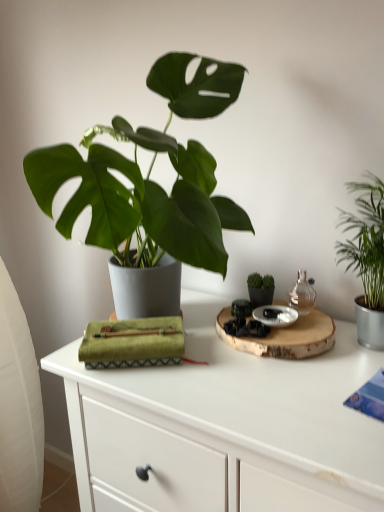
The height and width of the screenshot is (512, 384). What do you see at coordinates (302, 294) in the screenshot?
I see `transparent glass bottle at upper right` at bounding box center [302, 294].

Looking at this image, measure the distance between point (x=269, y=303) and camera.

Point (x=269, y=303) and camera are 3.36 feet apart.

You are a GUI agent. You are given a task and a screenshot of the screen. Output one action in this format:
    pyautogui.click(x=<x>, y=<y>)
    Task: Click on the transparent glass bottle at upper right
    
    Given the screenshot: What is the action you would take?
    pyautogui.click(x=302, y=294)

Based on the photo, in the image, is transparent glass bottle at upper right positioned in front of or behind matte black pot at center?

transparent glass bottle at upper right is positioned closer to the viewer than matte black pot at center.

The height and width of the screenshot is (512, 384). What are the coordinates of `glass vase above the matte black pot at center (from a real-world perspective)` in the screenshot? It's located at pos(302,294).

Between transparent glass bottle at upper right and matte black pot at center, which one has less height?

matte black pot at center.

Is green leafy plant at right surrounded by matte black pot at center?

No, green leafy plant at right is not inside matte black pot at center.

Can you confirm if matte black pot at center is bigger than green leafy plant at right?

No, matte black pot at center is not bigger than green leafy plant at right.

Is matte black pot at center placed right next to green leafy plant at right?

No, matte black pot at center is not next to green leafy plant at right.

Which of these two, matte black pot at center or green leafy plant at right, is wider?

Wider between the two is green leafy plant at right.

Is white matte table at center looking in the opposite direction of green leafy plant at right?

No, white matte table at center's orientation is not away from green leafy plant at right.

From a real-world perspective, is white matte table at center below green leafy plant at right?

Yes.

Does white matte table at center appear on the right side of green leafy plant at right?

In fact, white matte table at center is to the left of green leafy plant at right.

Looking at this image, is matte black pot at center taller or shorter than white matte table at center?

matte black pot at center is shorter than white matte table at center.

Between matte black pot at center and white matte table at center, which one appears on the left side from the viewer's perspective?

Positioned to the left is white matte table at center.

At what (x,y) coordinates should I click in order to perform the action: click on table in front of the matte black pot at center. Please return your answer as a coordinate pair (x, y). Looking at the image, I should click on (225, 426).

Between matte black pot at center and white matte table at center, which one has larger size?

Bigger between the two is white matte table at center.

Which is behind, point (339, 418) or point (301, 278)?

The point (301, 278) is farther from the camera.

Is white matte table at center at the right side of transparent glass bottle at upper right?

No.

From the image's perspective, which one is positioned lower, white matte table at center or transparent glass bottle at upper right?

white matte table at center.

Is white matte table at center wider than transparent glass bottle at upper right?

Correct, the width of white matte table at center exceeds that of transparent glass bottle at upper right.

Does transparent glass bottle at upper right have a lesser height compared to green leafy plant at right?

Yes.

Would you consider transparent glass bottle at upper right to be distant from green leafy plant at right?

No, transparent glass bottle at upper right is in close proximity to green leafy plant at right.

How different are the orientations of transparent glass bottle at upper right and green leafy plant at right in degrees?

The angle between the facing direction of transparent glass bottle at upper right and the facing direction of green leafy plant at right is 26.5 degrees.

Who is smaller, transparent glass bottle at upper right or green leafy plant at right?

Smaller between the two is transparent glass bottle at upper right.

Considering the relative sizes of green leafy plant at right and matte black pot at center in the image provided, is green leafy plant at right bigger than matte black pot at center?

Yes.

Which is correct: green leafy plant at right is inside matte black pot at center, or outside of it?

green leafy plant at right is not enclosed by matte black pot at center.

From the picture: Who is taller, green leafy plant at right or matte black pot at center?

green leafy plant at right.

Between green leafy plant at right and matte black pot at center, which one has smaller width?

With smaller width is matte black pot at center.

Locate an element on the screen. The width and height of the screenshot is (384, 512). glass vase that appears in front of the matte black pot at center is located at coordinates (302, 294).

At what (x,y) coordinates should I click in order to perform the action: click on flowerpot that appears behind the green leafy plant at right. Please return your answer as a coordinate pair (x, y). Image resolution: width=384 pixels, height=512 pixels. Looking at the image, I should click on (261, 296).

Which object lies further to the anchor point white matte table at center, matte black pot at center or transparent glass bottle at upper right?

Among the two, transparent glass bottle at upper right is located further to white matte table at center.

Which object lies further to the anchor point green leafy plant at right, matte black pot at center or transparent glass bottle at upper right?

matte black pot at center.

Which object lies nearer to the anchor point matte black pot at center, white matte table at center or green leafy plant at right?

Among the two, green leafy plant at right is located nearer to matte black pot at center.

Looking at the image, which one is located closer to transparent glass bottle at upper right, white matte table at center or green leafy plant at right?

green leafy plant at right is positioned closer to the anchor transparent glass bottle at upper right.

Based on the photo, which object lies further to the anchor point matte black pot at center, white matte table at center or transparent glass bottle at upper right?

white matte table at center is further to matte black pot at center.

Which object lies further to the anchor point green leafy plant at right, white matte table at center or transparent glass bottle at upper right?

white matte table at center.

When comparing their distances from green leafy plant at right, does matte black pot at center or white matte table at center seem closer?

matte black pot at center lies closer to green leafy plant at right than the other object.

Looking at the image, which one is located closer to matte black pot at center, transparent glass bottle at upper right or green leafy plant at right?

transparent glass bottle at upper right.

I want to click on flowerpot between transparent glass bottle at upper right and white matte table at center in the up-down direction, so click(x=261, y=296).

The width and height of the screenshot is (384, 512). What are the coordinates of `glass vase between green leafy plant at right and white matte table at center in the up-down direction` in the screenshot? It's located at (302, 294).

Where is `flowerpot between green leafy plant at right and white matte table at center from top to bottom`? The height and width of the screenshot is (512, 384). flowerpot between green leafy plant at right and white matte table at center from top to bottom is located at coordinates (261, 296).

Identify the location of glass vase between green leafy plant at right and matte black pot at center from front to back. The width and height of the screenshot is (384, 512). (302, 294).